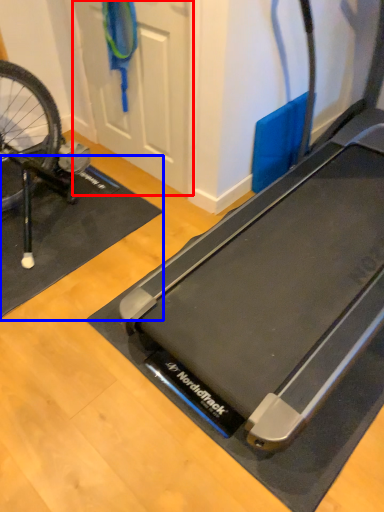
Question: Which object appears closest to the camera in this image, door (highlighted by a red box) or yoga mat (highlighted by a blue box)?

Choices:
 (A) door
 (B) yoga mat

Answer: (A)